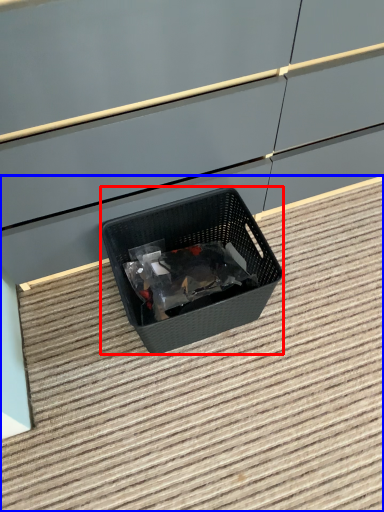
Question: Which object is further to the camera taking this photo, waste container (highlighted by a red box) or stair (highlighted by a blue box)?

Choices:
 (A) waste container
 (B) stair

Answer: (A)